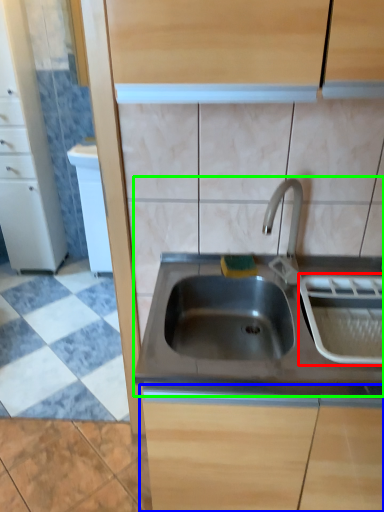
Question: Estimate the real-world distances between objects in this image. Which object is farther from appliance (highlighted by a red box), cabinetry (highlighted by a blue box) or sink (highlighted by a green box)?

Choices:
 (A) cabinetry
 (B) sink

Answer: (A)